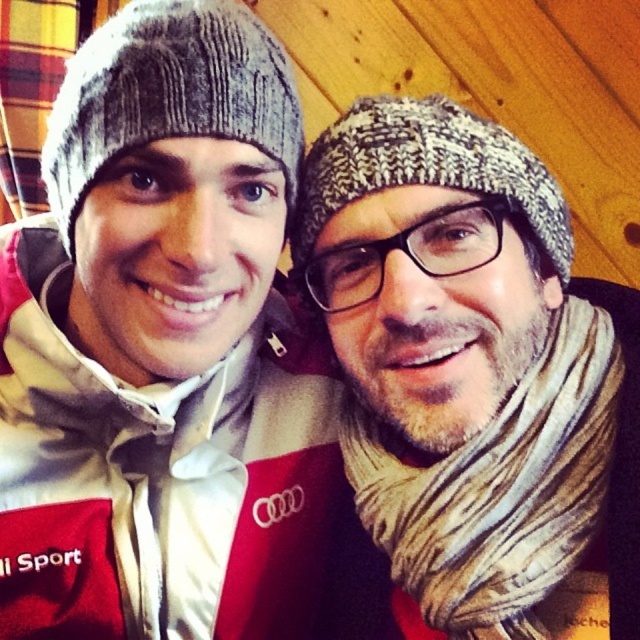
Question: Considering the relative positions of striped wool scarf at right and gray knitted beanie at upper left in the image provided, where is striped wool scarf at right located with respect to gray knitted beanie at upper left?

Choices:
 (A) left
 (B) right

Answer: (B)

Question: Which object is the closest to the gray knitted beanie at upper left?

Choices:
 (A) striped wool scarf at right
 (B) knitted gray hat at center

Answer: (B)

Question: Among these points, which one is farthest from the camera?

Choices:
 (A) (436, 544)
 (B) (410, 116)
 (C) (61, 90)

Answer: (C)

Question: Does gray knitted beanie at upper left have a smaller size compared to knitted gray hat at center?

Choices:
 (A) yes
 (B) no

Answer: (A)

Question: Is striped wool scarf at right smaller than gray knitted beanie at upper left?

Choices:
 (A) yes
 (B) no

Answer: (B)

Question: Which is farther from the knitted gray hat at center?

Choices:
 (A) striped wool scarf at right
 (B) gray knitted beanie at upper left

Answer: (A)